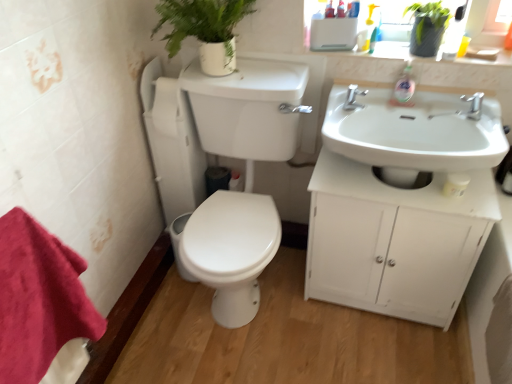
Question: Is point (472, 97) positioned closer to the camera than point (358, 92)?

Choices:
 (A) farther
 (B) closer

Answer: (B)

Question: Considering the positions of silver metallic faucet at upper right, acting as the 1th tap starting from the right, and silver metallic tap at upper center, which ranks as the second tap in right-to-left order, in the image, is silver metallic faucet at upper right, acting as the 1th tap starting from the right, wider or thinner than silver metallic tap at upper center, which ranks as the second tap in right-to-left order,?

Choices:
 (A) wide
 (B) thin

Answer: (A)

Question: Which object is the closest to the green matte plant at upper right, the second plant viewed from the left?

Choices:
 (A) white glossy sink at right
 (B) silver metallic tap at upper center, which ranks as the second tap in right-to-left order
 (C) yellow plastic cup at upper right
 (D) red cotton towel at lower left
 (E) white glossy toilet bowl at lower center

Answer: (C)

Question: Based on their relative distances, which object is farther from the white glossy toilet at center-left?

Choices:
 (A) green matte plant at upper center, which is the 2th plant from right to left
 (B) silver metallic faucet at upper right, acting as the 1th tap starting from the right
 (C) white matte cabinet at right
 (D) green matte plant at upper right, the second plant viewed from the left
 (E) white glossy toilet bowl at lower center

Answer: (B)